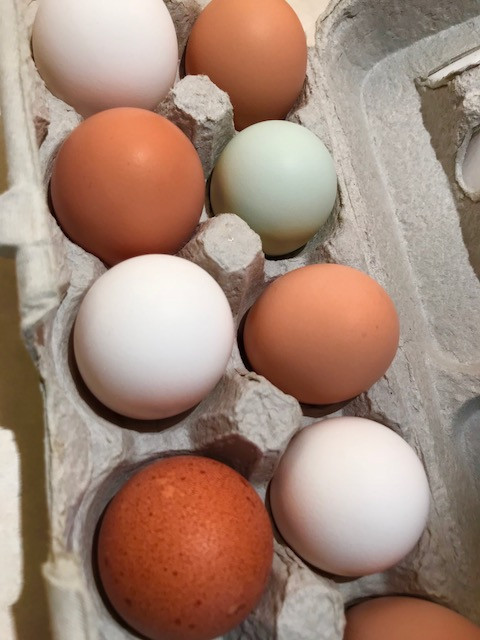
Image resolution: width=480 pixels, height=640 pixels. Identify the location of tan table. (312, 4), (8, 548), (6, 500).